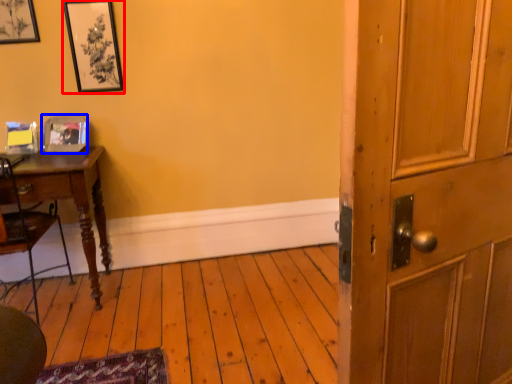
Question: Which object appears closest to the camera in this image, picture frame (highlighted by a red box) or picture frame (highlighted by a blue box)?

Choices:
 (A) picture frame
 (B) picture frame

Answer: (A)